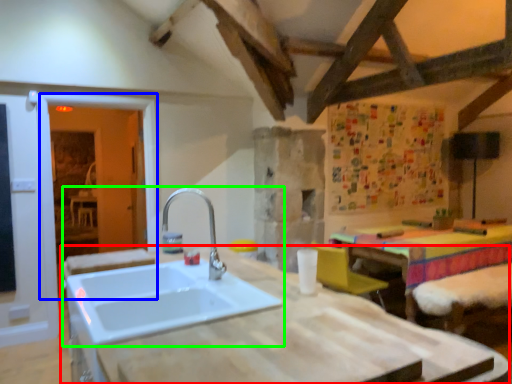
Question: Considering the real-world distances, which object is farthest from countertop (highlighted by a red box)? glass door (highlighted by a blue box) or sink (highlighted by a green box)?

Choices:
 (A) glass door
 (B) sink

Answer: (A)